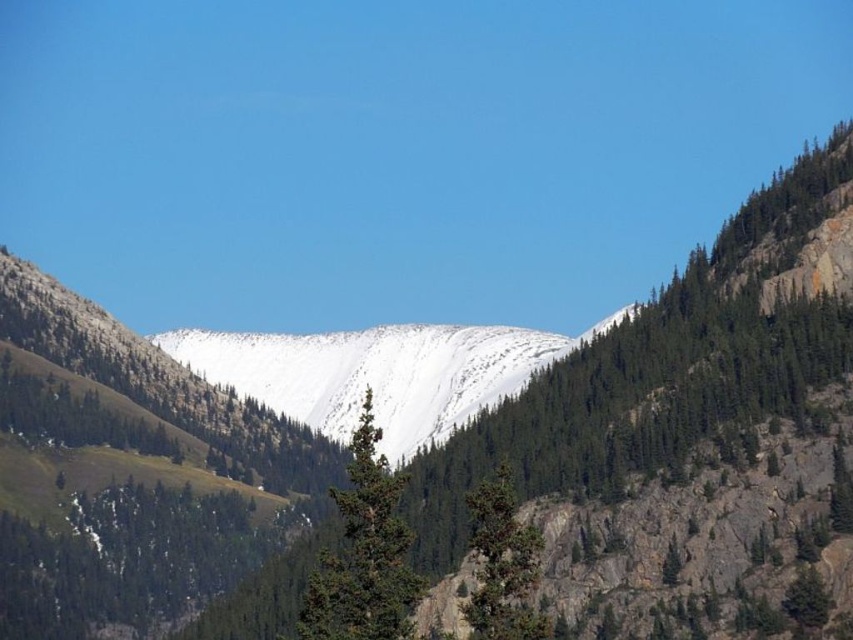
Question: Is white matte snow at center smaller than green textured tree at center?

Choices:
 (A) yes
 (B) no

Answer: (B)

Question: Can you confirm if white matte snow at center is wider than green rough bark tree at center?

Choices:
 (A) no
 (B) yes

Answer: (B)

Question: Which point is farther to the camera?

Choices:
 (A) white matte snow at center
 (B) green rough bark tree at center

Answer: (A)

Question: Which object appears farthest from the camera in this image?

Choices:
 (A) white matte snow at center
 (B) green rough bark tree at center

Answer: (A)

Question: Which object is the farthest from the white matte snow at center?

Choices:
 (A) green textured tree at center
 (B) green rough bark tree at center

Answer: (B)

Question: Can you confirm if green textured tree at center is bigger than green rough bark tree at center?

Choices:
 (A) no
 (B) yes

Answer: (B)